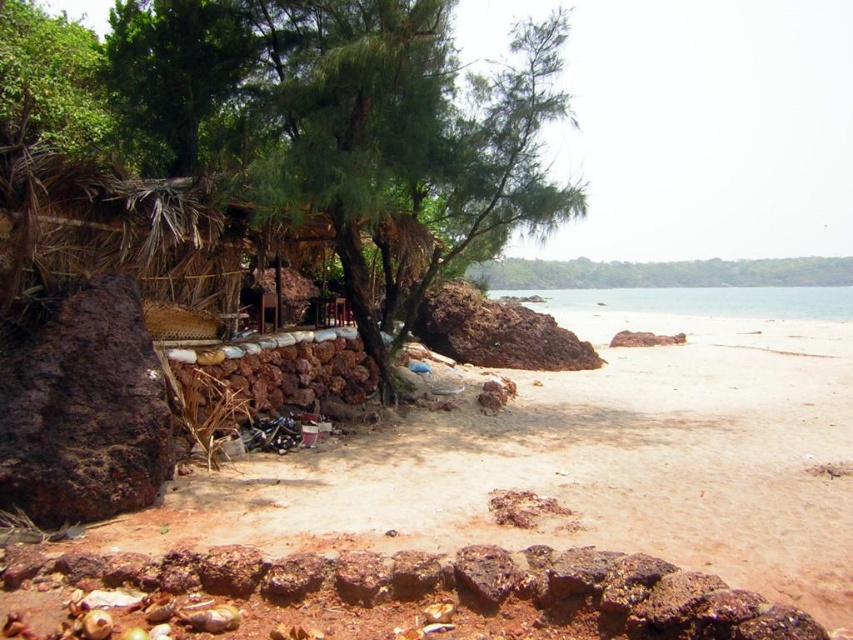
You are standing on the beach and see the point marked at coordinates (282,150). Based on the scene description, can you determine what this point is located on?

The point marked at coordinates (282,150) is located on the green leafy tree at left.

You are a hiker who wants to place a small backpack between the brown rock at left and the rusty stone wall at lower left. Based on their positions, can you tell me which object you should place the backpack closer to in order to have it closer to the wall?

The rusty stone wall at lower left is behind the brown rock at left, so to place the backpack closer to the wall, you should position it closer to the rusty stone wall at lower left.

From the picture: You are a hiker who needs to cross a narrow path between the brown rock at left and the rusty stone wall at lower left. The path is only as wide as the narrower of the two objects. Can your 0.5 meter wide backpack fit through?

The brown rock at left is wider than the rusty stone wall at lower left. Since the path is as wide as the narrower object, which is the rusty stone wall at lower left, and its width is less than 0.5 meters, the backpack may not fit through.